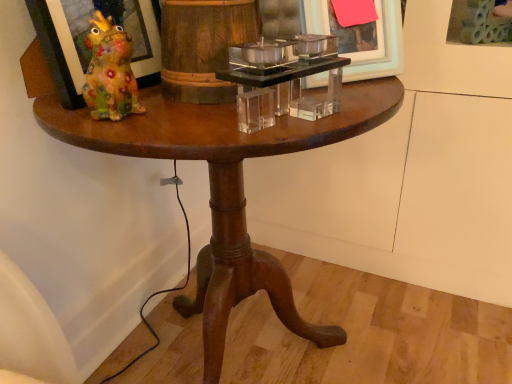
Question: Is matte glass picture frame at left, which is the first picture frame in left-to-right order, not within clear acrylic picture frame at upper right, the first picture frame when ordered from right to left?

Choices:
 (A) no
 (B) yes

Answer: (B)

Question: Does matte glass picture frame at left, which appears as the third picture frame when viewed from the right, have a lesser height compared to clear acrylic picture frame at upper right, the first picture frame when ordered from right to left?

Choices:
 (A) yes
 (B) no

Answer: (B)

Question: Considering the relative positions of matte glass picture frame at left, which appears as the third picture frame when viewed from the right, and clear acrylic picture frame at upper right, which ranks as the third picture frame in left-to-right order, in the image provided, is matte glass picture frame at left, which appears as the third picture frame when viewed from the right, to the left of clear acrylic picture frame at upper right, which ranks as the third picture frame in left-to-right order, from the viewer's perspective?

Choices:
 (A) no
 (B) yes

Answer: (B)

Question: Is matte glass picture frame at left, which appears as the third picture frame when viewed from the right, wider than clear acrylic picture frame at upper right, which ranks as the third picture frame in left-to-right order?

Choices:
 (A) no
 (B) yes

Answer: (A)

Question: From the image's perspective, is matte glass picture frame at left, which is the first picture frame in left-to-right order, over clear acrylic picture frame at upper right, which ranks as the third picture frame in left-to-right order?

Choices:
 (A) yes
 (B) no

Answer: (B)

Question: From the image's perspective, is matte white picture frame at upper center, marked as the 2th picture frame in a right-to-left arrangement, positioned above or below clear acrylic picture frame at upper right, which ranks as the third picture frame in left-to-right order?

Choices:
 (A) above
 (B) below

Answer: (B)

Question: Based on their sizes in the image, would you say matte white picture frame at upper center, which ranks as the second picture frame in left-to-right order, is bigger or smaller than clear acrylic picture frame at upper right, which ranks as the third picture frame in left-to-right order?

Choices:
 (A) small
 (B) big

Answer: (A)

Question: Visually, is matte white picture frame at upper center, marked as the 2th picture frame in a right-to-left arrangement, positioned to the left or to the right of clear acrylic picture frame at upper right, the first picture frame when ordered from right to left?

Choices:
 (A) left
 (B) right

Answer: (A)

Question: Does point (371, 43) appear closer or farther from the camera than point (448, 31)?

Choices:
 (A) closer
 (B) farther

Answer: (A)

Question: In the image, is wooden pedestal table at center on the left side or the right side of matte white picture frame at upper center, which ranks as the second picture frame in left-to-right order?

Choices:
 (A) left
 (B) right

Answer: (A)

Question: Is wooden pedestal table at center wider or thinner than matte white picture frame at upper center, marked as the 2th picture frame in a right-to-left arrangement?

Choices:
 (A) thin
 (B) wide

Answer: (B)

Question: From a real-world perspective, is wooden pedestal table at center positioned above or below matte white picture frame at upper center, marked as the 2th picture frame in a right-to-left arrangement?

Choices:
 (A) below
 (B) above

Answer: (A)

Question: Is wooden pedestal table at center in front of or behind matte white picture frame at upper center, which ranks as the second picture frame in left-to-right order, in the image?

Choices:
 (A) behind
 (B) front

Answer: (B)

Question: From a real-world perspective, is matte glass picture frame at left, which appears as the third picture frame when viewed from the right, above or below clear acrylic candle holder at center?

Choices:
 (A) above
 (B) below

Answer: (A)

Question: Is point (61, 66) closer or farther from the camera than point (294, 82)?

Choices:
 (A) farther
 (B) closer

Answer: (B)